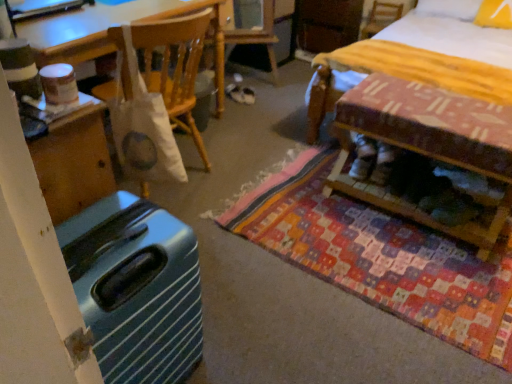
Question: Is the depth of wooden chair at upper right less than that of white suede shoes at center?

Choices:
 (A) yes
 (B) no

Answer: (B)

Question: From a real-world perspective, is wooden chair at upper right over white suede shoes at center?

Choices:
 (A) yes
 (B) no

Answer: (A)

Question: Is wooden chair at upper right behind white suede shoes at center?

Choices:
 (A) no
 (B) yes

Answer: (B)

Question: Is wooden chair at upper right not close to white suede shoes at center?

Choices:
 (A) yes
 (B) no

Answer: (A)

Question: Considering the relative positions of wooden chair at upper right and white suede shoes at center in the image provided, is wooden chair at upper right to the right of white suede shoes at center from the viewer's perspective?

Choices:
 (A) yes
 (B) no

Answer: (A)

Question: Can you confirm if wooden chair at upper right is wider than white suede shoes at center?

Choices:
 (A) no
 (B) yes

Answer: (B)

Question: Is patchwork fabric mat at center to the left of teal glossy suitcase at lower left from the viewer's perspective?

Choices:
 (A) no
 (B) yes

Answer: (A)

Question: From a real-world perspective, is patchwork fabric mat at center positioned under teal glossy suitcase at lower left based on gravity?

Choices:
 (A) yes
 (B) no

Answer: (A)

Question: Considering the relative positions of patchwork fabric mat at center and teal glossy suitcase at lower left in the image provided, is patchwork fabric mat at center to the right of teal glossy suitcase at lower left from the viewer's perspective?

Choices:
 (A) no
 (B) yes

Answer: (B)

Question: Is teal glossy suitcase at lower left inside patchwork fabric mat at center?

Choices:
 (A) yes
 (B) no

Answer: (B)

Question: Is patchwork fabric mat at center oriented away from teal glossy suitcase at lower left?

Choices:
 (A) no
 (B) yes

Answer: (A)

Question: Can you confirm if patchwork fabric mat at center is shorter than teal glossy suitcase at lower left?

Choices:
 (A) no
 (B) yes

Answer: (B)

Question: From a real-world perspective, does white fabric bag at upper center sit lower than white suede shoes at center?

Choices:
 (A) no
 (B) yes

Answer: (A)